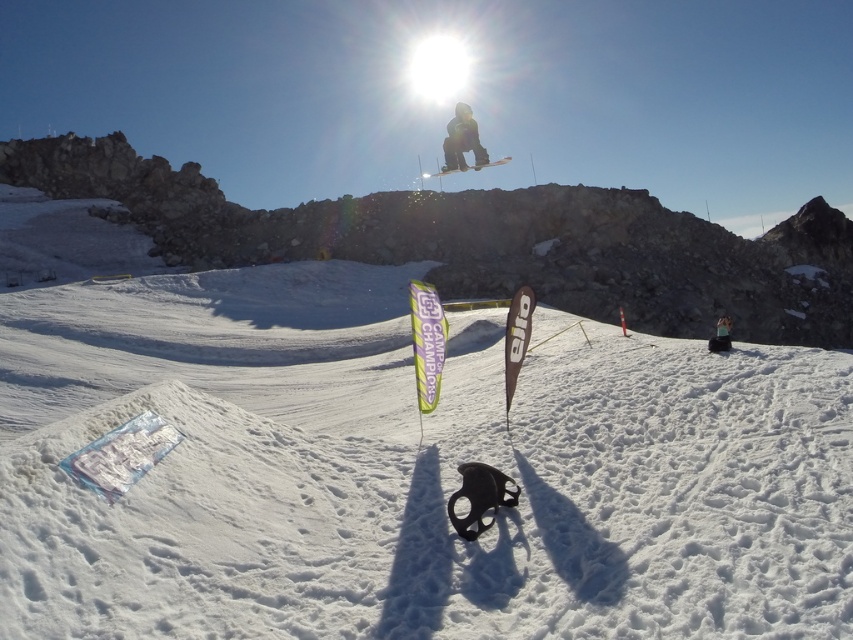
This screenshot has height=640, width=853. In order to click on black matte snowboarder at center in this screenshot , I will do `click(462, 140)`.

Can you confirm if black matte snowboarder at center is taller than white matte snowboard at center?

No.

Who is more forward, [456,104] or [463,170]?

Point [463,170] is more forward.

Locate an element on the screen. black matte snowboarder at center is located at coordinates (462, 140).

Between white powder snow at center and smooth black snowboarder at center, which one appears on the left side from the viewer's perspective?

white powder snow at center is more to the left.

Which of these two, white powder snow at center or smooth black snowboarder at center, stands taller?

With more height is white powder snow at center.

The height and width of the screenshot is (640, 853). Find the location of `white powder snow at center`. white powder snow at center is located at coordinates (410, 472).

Which is above, white powder snow at center or white snow at center?

white snow at center is above.

Which is in front, point (476, 326) or point (705, 228)?

Point (476, 326) is more forward.

Which is behind, point (804, 387) or point (293, 237)?

The point (293, 237) is behind.

This screenshot has height=640, width=853. What are the coordinates of `white powder snow at center` in the screenshot? It's located at (410, 472).